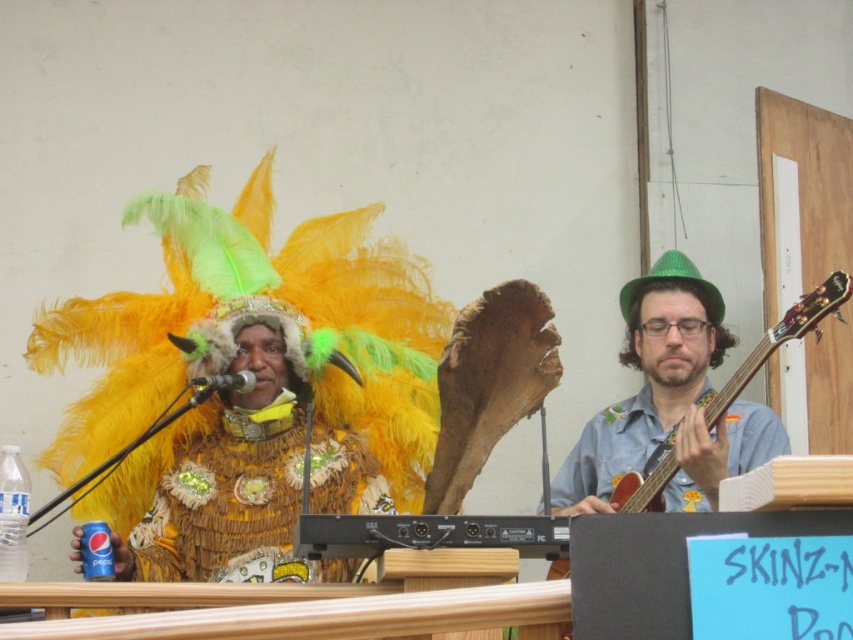
You are organizing a small stage for a performance and need to place the shiny gold costume at center and the wooden acoustic guitar at right. Given that the stage has limited space, which object should be placed first to ensure both fit properly?

The shiny gold costume at center is larger in size than the wooden acoustic guitar at right, so you should place the shiny gold costume at center first to ensure there is enough space for both objects on the stage.

You are a photographer at a music event and need to capture a photo where both the shiny gold costume at center and the wooden acoustic guitar at right are clearly visible. Considering their sizes, which object should you focus on first to ensure proper framing?

The shiny gold costume at center is taller than the wooden acoustic guitar at right, so you should focus on the shiny gold costume at center first to ensure it fits within the frame properly.